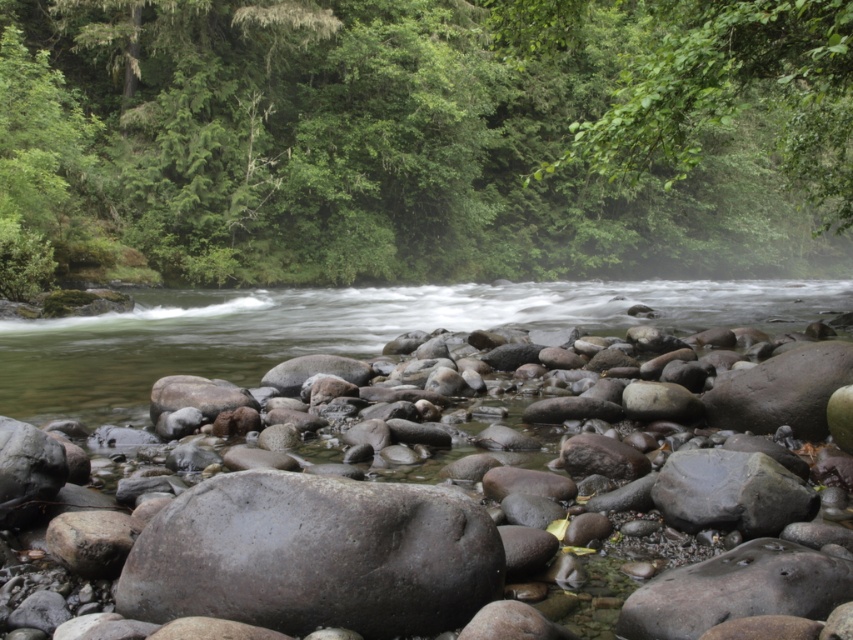
Does gray matte rock at center have a greater width compared to gray smooth rock at center?

No.

Between gray matte rock at center and gray smooth rock at center, which one has less height?

gray matte rock at center is shorter.

The width and height of the screenshot is (853, 640). I want to click on gray matte rock at center, so click(315, 556).

Image resolution: width=853 pixels, height=640 pixels. Identify the location of gray matte rock at center. (315, 556).

Which is behind, point (138, 184) or point (531, 390)?

Point (138, 184)

Does green leafy tree at upper center appear over gray smooth rock at center?

Yes.

Find the location of a particular element. Image resolution: width=853 pixels, height=640 pixels. green leafy tree at upper center is located at coordinates point(422,138).

Is green leafy tree at upper center to the right of gray matte rock at center from the viewer's perspective?

Correct, you'll find green leafy tree at upper center to the right of gray matte rock at center.

Is point (370, 216) positioned behind point (163, 572)?

Yes.

At what (x,y) coordinates should I click in order to perform the action: click on green leafy tree at upper center. Please return your answer as a coordinate pair (x, y). This screenshot has height=640, width=853. Looking at the image, I should click on (422, 138).